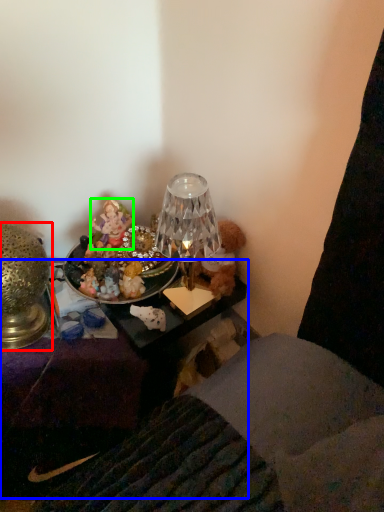
Question: Considering the real-world distances, which object is farthest from lamp (highlighted by a red box)? furniture (highlighted by a blue box) or person (highlighted by a green box)?

Choices:
 (A) furniture
 (B) person

Answer: (A)